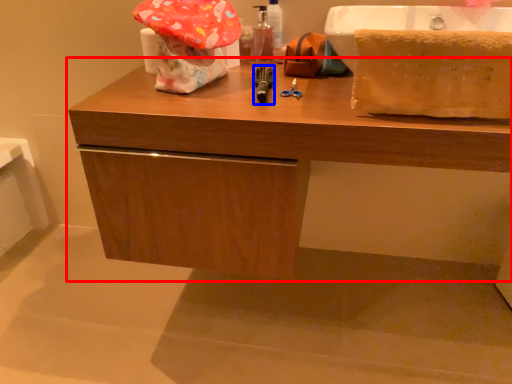
Question: Which object appears farthest to the camera in this image, bathroom cabinet (highlighted by a red box) or tool (highlighted by a blue box)?

Choices:
 (A) bathroom cabinet
 (B) tool

Answer: (B)